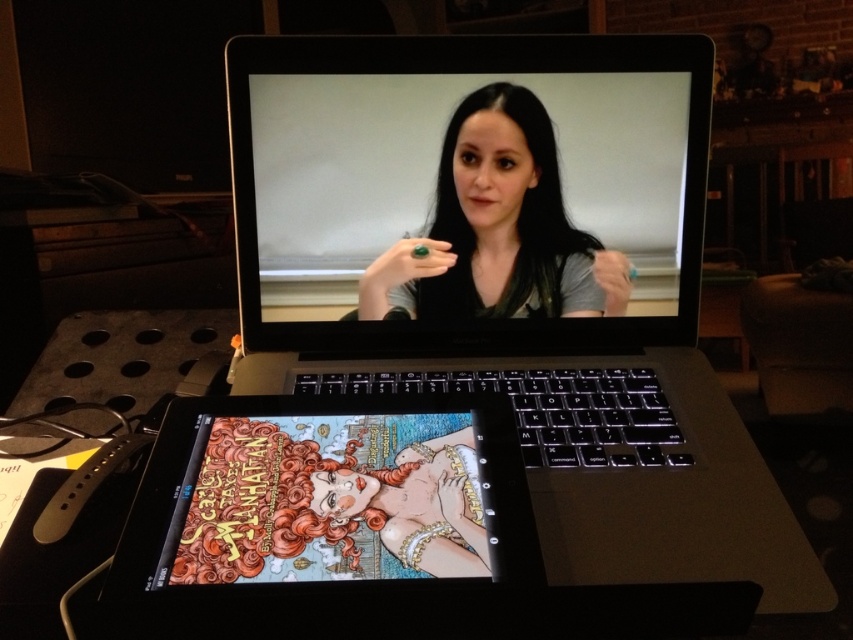
Is satin black laptop at center to the left of matte black ring at center from the viewer's perspective?

Yes, satin black laptop at center is to the left of matte black ring at center.

This screenshot has width=853, height=640. What do you see at coordinates (469, 195) in the screenshot?
I see `satin black laptop at center` at bounding box center [469, 195].

Between point (486, 340) and point (370, 273), which one is positioned behind?

Point (486, 340)

Locate an element on the screen. This screenshot has width=853, height=640. satin black laptop at center is located at coordinates (469, 195).

Does sleek silver laptop at center have a lesser width compared to satin black laptop at center?

Correct, sleek silver laptop at center's width is less than satin black laptop at center's.

Can you confirm if sleek silver laptop at center is bigger than satin black laptop at center?

Correct, sleek silver laptop at center is larger in size than satin black laptop at center.

Who is more distant from viewer, (657, 579) or (431, 208)?

Positioned behind is point (431, 208).

Locate an element on the screen. This screenshot has height=640, width=853. sleek silver laptop at center is located at coordinates (526, 292).

Which is behind, point (624, 212) or point (550, 310)?

Point (550, 310)

Who is positioned more to the right, sleek silver laptop at center or matte black ring at center?

From the viewer's perspective, sleek silver laptop at center appears more on the right side.

Describe the element at coordinates (526, 292) in the screenshot. I see `sleek silver laptop at center` at that location.

In order to click on sleek silver laptop at center in this screenshot , I will do `click(526, 292)`.